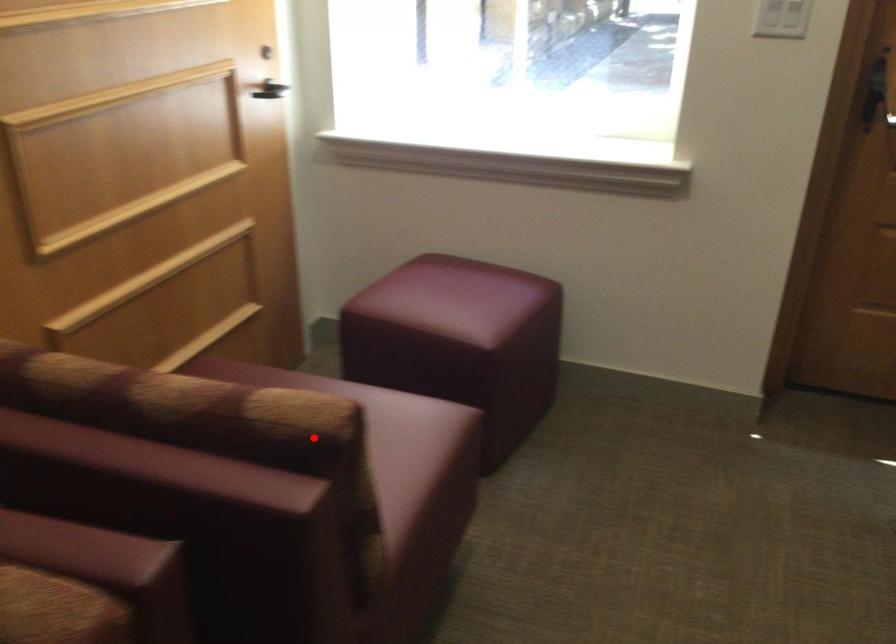
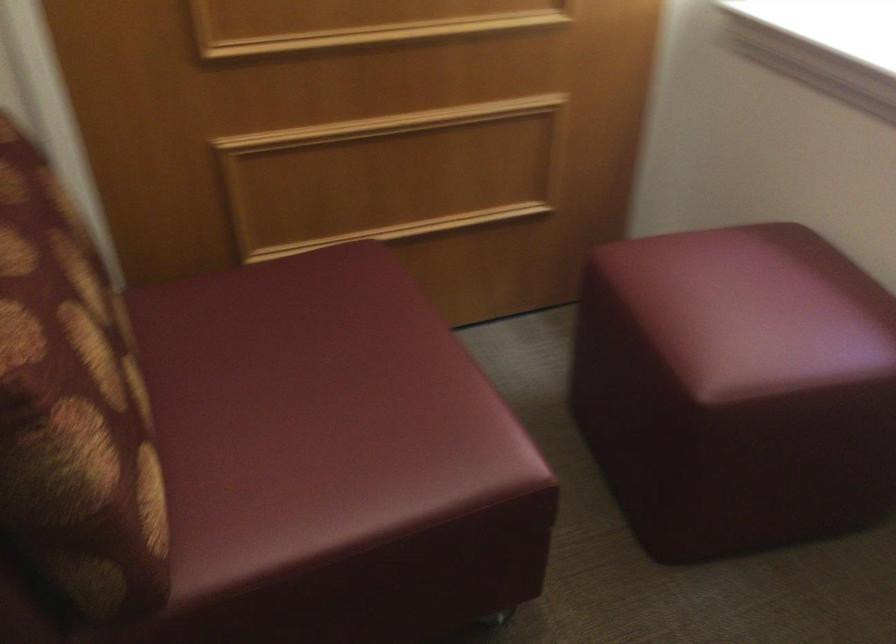
Locate, in the second image, the point that corresponds to the highlighted location in the first image.

(72, 406)